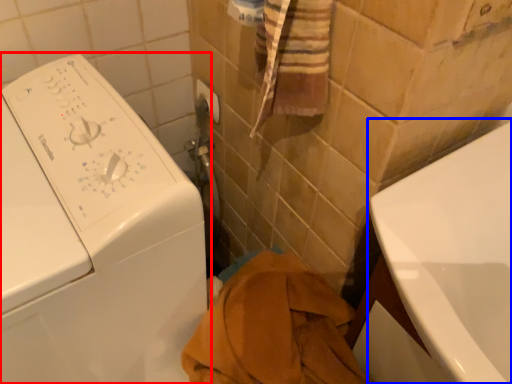
Question: Which point is further to the camera, washing machine (highlighted by a red box) or bath (highlighted by a blue box)?

Choices:
 (A) washing machine
 (B) bath

Answer: (B)